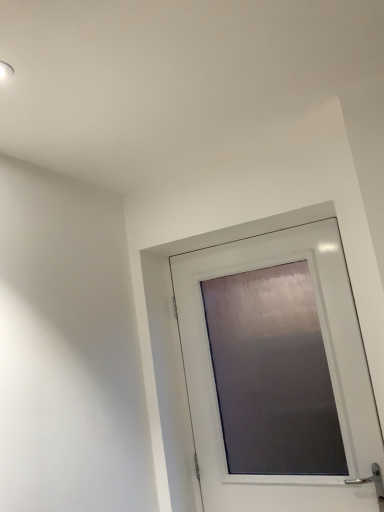
Describe the element at coordinates (277, 373) in the screenshot. The height and width of the screenshot is (512, 384). I see `satin white door at center` at that location.

What are the coordinates of `satin white door at center` in the screenshot? It's located at (277, 373).

Locate an element on the screen. satin white door at center is located at coordinates (277, 373).